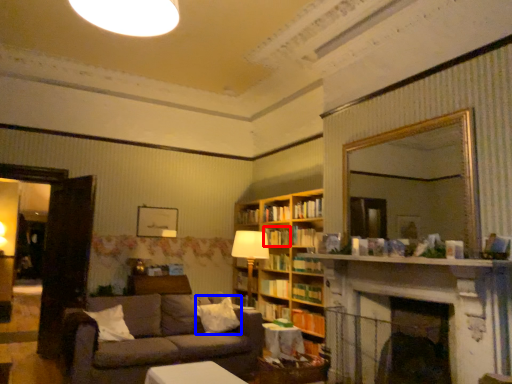
Question: Which of the following is the farthest to the observer, book (highlighted by a red box) or pillow (highlighted by a blue box)?

Choices:
 (A) book
 (B) pillow

Answer: (A)